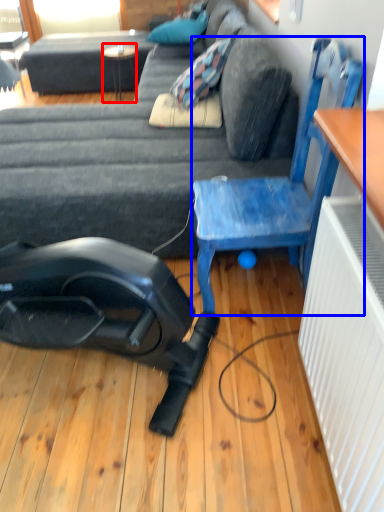
Question: Among these objects, which one is nearest to the camera, table (highlighted by a red box) or chair (highlighted by a blue box)?

Choices:
 (A) table
 (B) chair

Answer: (B)